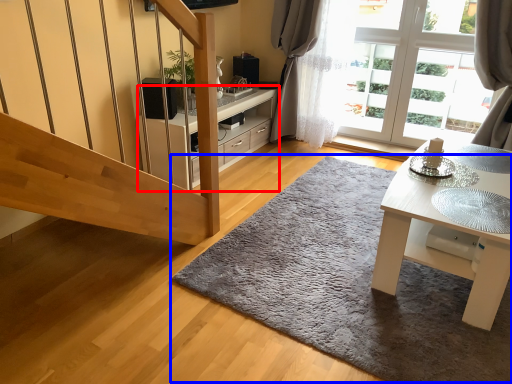
Question: Which object is further to the camera taking this photo, cabinetry (highlighted by a red box) or doormat (highlighted by a blue box)?

Choices:
 (A) cabinetry
 (B) doormat

Answer: (A)